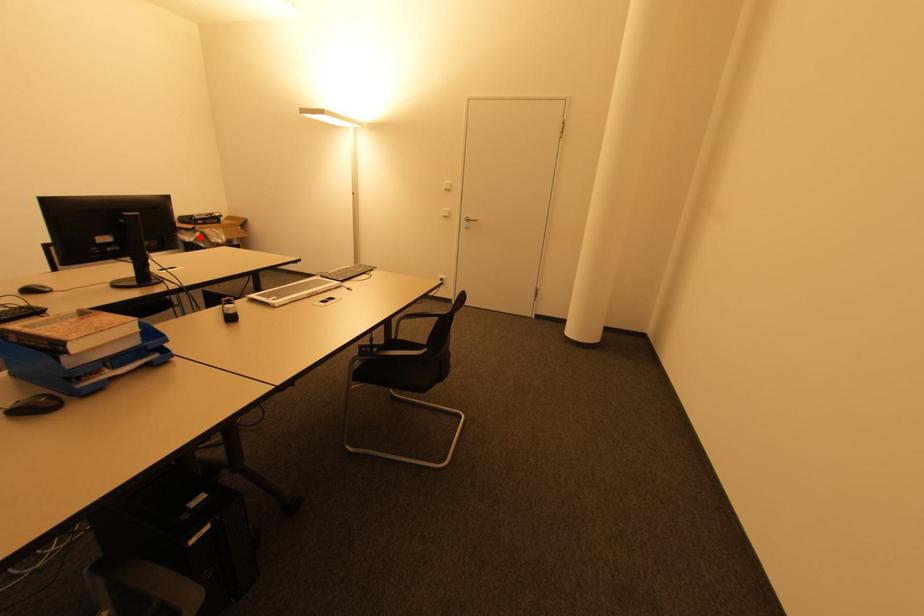
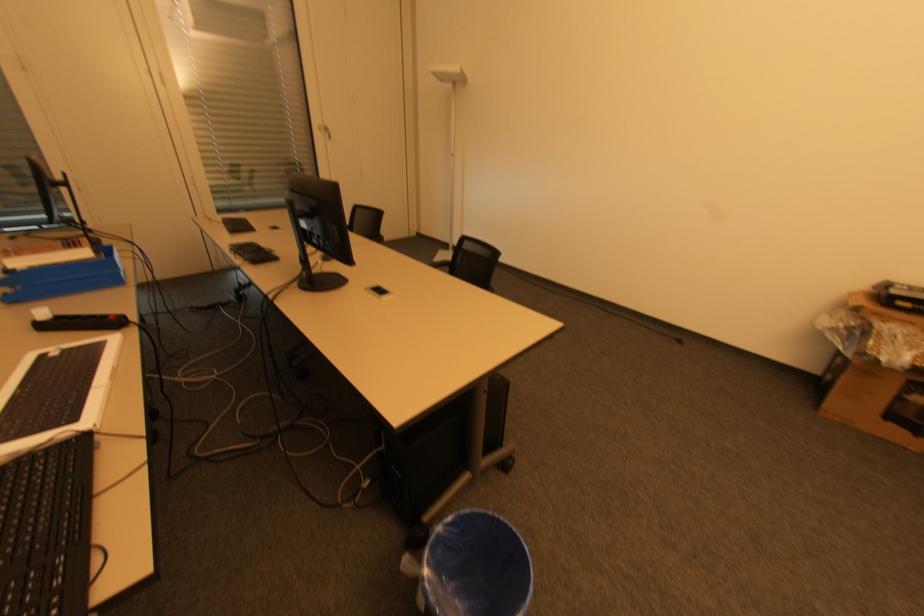
Question: I am providing you with two images of the same scene from different viewpoints. A red point is shown in image1. For the corresponding object point in image2, is it positioned nearer or farther from the camera?

Choices:
 (A) Nearer
 (B) Farther

Answer: (B)